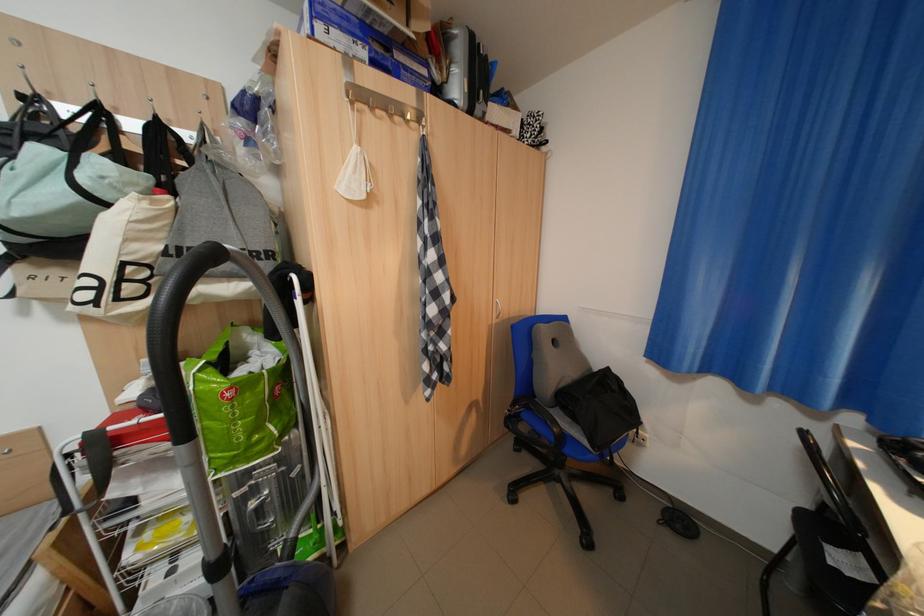
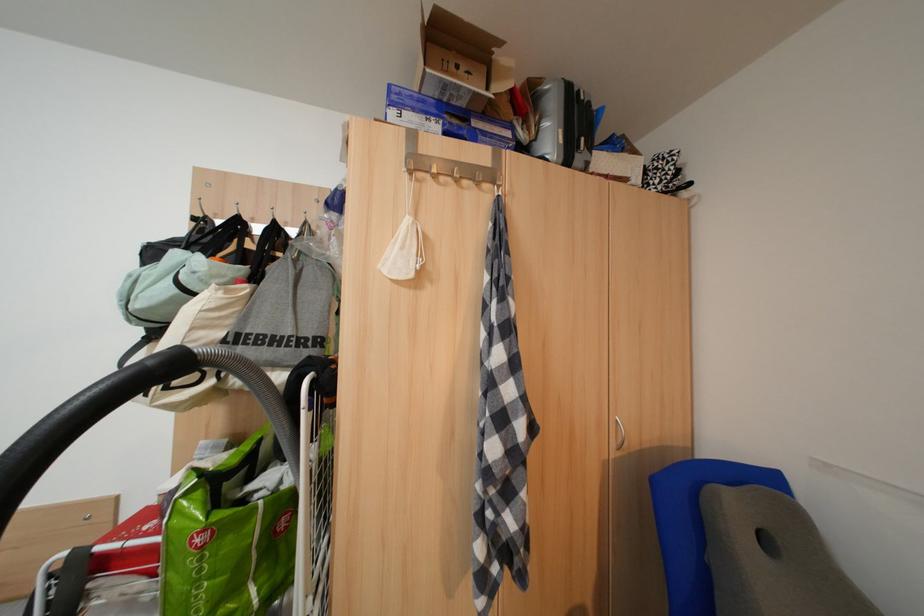
In the second image, find the point that corresponds to (x=387, y=28) in the first image.

(466, 103)